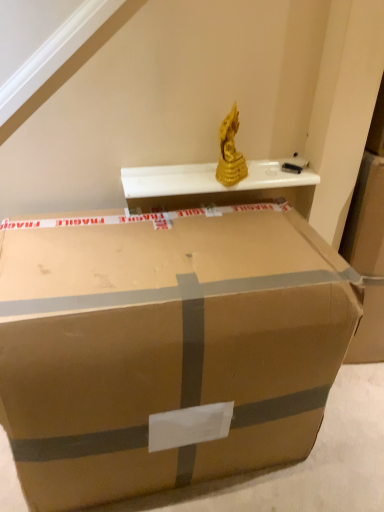
Question: From a real-world perspective, is white glossy shelf at upper center over brown cardboard box at center?

Choices:
 (A) no
 (B) yes

Answer: (B)

Question: Is white glossy shelf at upper center oriented towards brown cardboard box at center?

Choices:
 (A) no
 (B) yes

Answer: (A)

Question: Is white glossy shelf at upper center looking in the opposite direction of brown cardboard box at center?

Choices:
 (A) yes
 (B) no

Answer: (B)

Question: Can you confirm if white glossy shelf at upper center is positioned to the left of brown cardboard box at center?

Choices:
 (A) yes
 (B) no

Answer: (B)

Question: Considering the relative sizes of white glossy shelf at upper center and brown cardboard box at center in the image provided, is white glossy shelf at upper center shorter than brown cardboard box at center?

Choices:
 (A) yes
 (B) no

Answer: (A)

Question: Does white glossy shelf at upper center come in front of brown cardboard box at center?

Choices:
 (A) yes
 (B) no

Answer: (B)

Question: From the image's perspective, is brown cardboard box at center under white glossy shelf at upper center?

Choices:
 (A) yes
 (B) no

Answer: (A)

Question: From a real-world perspective, is brown cardboard box at center positioned under white glossy shelf at upper center based on gravity?

Choices:
 (A) no
 (B) yes

Answer: (B)

Question: Would you say white glossy shelf at upper center is part of brown cardboard box at center's contents?

Choices:
 (A) yes
 (B) no

Answer: (B)

Question: Considering the relative positions of brown cardboard box at center and white glossy shelf at upper center in the image provided, is brown cardboard box at center to the right of white glossy shelf at upper center from the viewer's perspective?

Choices:
 (A) no
 (B) yes

Answer: (A)

Question: Is brown cardboard box at center closer to camera compared to white glossy shelf at upper center?

Choices:
 (A) yes
 (B) no

Answer: (A)

Question: Does brown cardboard box at center have a smaller size compared to white glossy shelf at upper center?

Choices:
 (A) no
 (B) yes

Answer: (A)

Question: Would you say brown cardboard box at center is inside or outside white glossy shelf at upper center?

Choices:
 (A) inside
 (B) outside

Answer: (B)